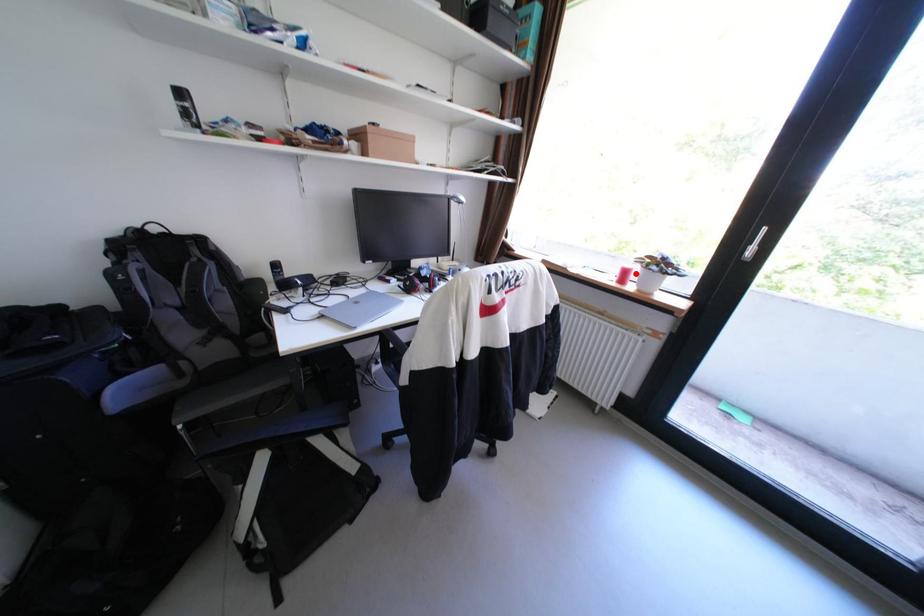
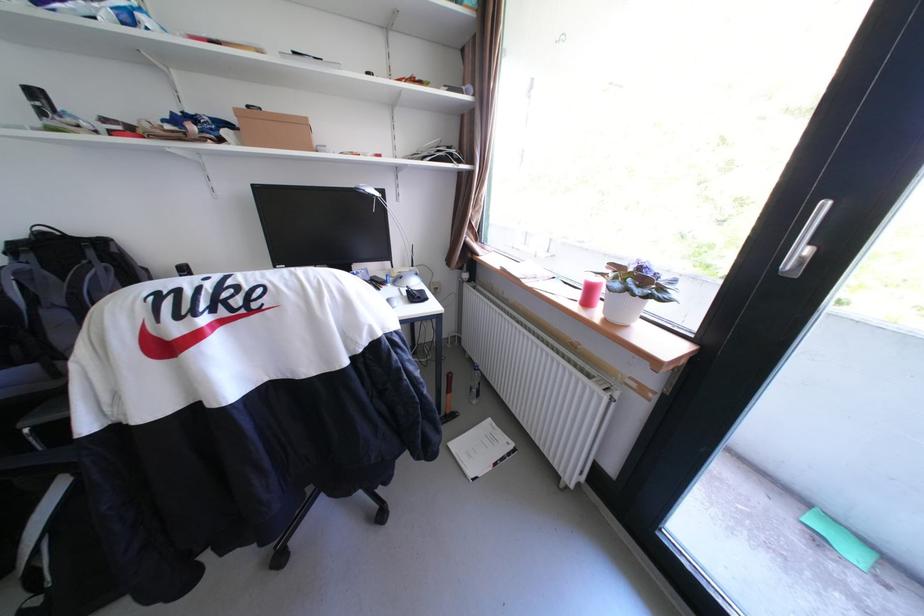
In the second image, find the point that corresponds to the highlighted location in the first image.

(601, 291)